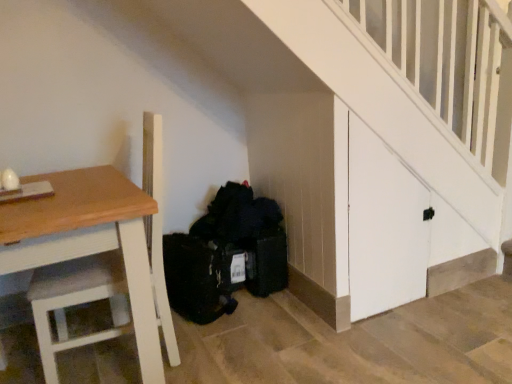
The width and height of the screenshot is (512, 384). Describe the element at coordinates (89, 240) in the screenshot. I see `wooden table at left` at that location.

At what (x,y) coordinates should I click in order to perform the action: click on wooden table at left. Please return your answer as a coordinate pair (x, y). Image resolution: width=512 pixels, height=384 pixels. Looking at the image, I should click on (89, 240).

Image resolution: width=512 pixels, height=384 pixels. What do you see at coordinates (248, 235) in the screenshot?
I see `black fabric bag at lower center` at bounding box center [248, 235].

In order to click on black fabric bag at lower center in this screenshot , I will do `click(248, 235)`.

Where is `wooden table at left`? wooden table at left is located at coordinates (89, 240).

Is wooden table at left at the left side of black fabric bag at lower center?

Indeed, wooden table at left is positioned on the left side of black fabric bag at lower center.

Does wooden table at left lie in front of black fabric bag at lower center?

Yes, wooden table at left is closer to the camera.

Is point (95, 191) positioned behind point (206, 218)?

No, it is in front of (206, 218).

From the image's perspective, is wooden table at left on top of black fabric bag at lower center?

No, from the image's perspective, wooden table at left is not over black fabric bag at lower center.

From a real-world perspective, who is located higher, wooden table at left or black fabric bag at lower center?

In real-world perspective, wooden table at left is above.

From the picture: Which of these two, wooden table at left or black fabric bag at lower center, is thinner?

With smaller width is black fabric bag at lower center.

Who is taller, wooden table at left or black fabric bag at lower center?

Answer: wooden table at left.

Can you confirm if wooden table at left is bigger than black fabric bag at lower center?

Yes.

Is wooden table at left positioned beyond the bounds of black fabric bag at lower center?

That's correct, wooden table at left is outside of black fabric bag at lower center.

Would you say wooden table at left is a long distance from black fabric bag at lower center?

They are positioned close to each other.

Could you tell me if wooden table at left is turned towards black fabric bag at lower center?

Yes, wooden table at left faces towards black fabric bag at lower center.

What's the angular difference between wooden table at left and black fabric bag at lower center's facing directions?

90.4 degrees separate the facing orientations of wooden table at left and black fabric bag at lower center.

You are a GUI agent. You are given a task and a screenshot of the screen. Output one action in this format:
    pyautogui.click(x=<x>, y=<y>)
    Task: Click on the table that is in front of the black fabric bag at lower center
    
    Given the screenshot: What is the action you would take?
    pyautogui.click(x=89, y=240)

Is black fabric bag at lower center to the right of wooden table at left from the viewer's perspective?

Yes, black fabric bag at lower center is to the right of wooden table at left.

Is black fabric bag at lower center closer to the viewer compared to wooden table at left?

No, the depth of black fabric bag at lower center is greater than that of wooden table at left.

Is point (222, 231) closer or farther from the camera than point (81, 248)?

Point (222, 231).

From the image's perspective, is black fabric bag at lower center beneath wooden table at left?

Actually, black fabric bag at lower center appears above wooden table at left in the image.

From a real-world perspective, which is physically above, black fabric bag at lower center or wooden table at left?

wooden table at left.

Can you confirm if black fabric bag at lower center is wider than wooden table at left?

In fact, black fabric bag at lower center might be narrower than wooden table at left.

Considering the relative sizes of black fabric bag at lower center and wooden table at left in the image provided, is black fabric bag at lower center shorter than wooden table at left?

Yes.

Is black fabric bag at lower center bigger than wooden table at left?

No, black fabric bag at lower center is not bigger than wooden table at left.

Is black fabric bag at lower center outside of wooden table at left?

That's correct, black fabric bag at lower center is outside of wooden table at left.

Consider the image. Would you consider black fabric bag at lower center to be distant from wooden table at left?

No.

Consider the image. Is black fabric bag at lower center facing towards wooden table at left?

No, black fabric bag at lower center is not aimed at wooden table at left.

How different are the orientations of black fabric bag at lower center and wooden table at left in degrees?

They differ by 90.4 degrees in their facing directions.

Measure the distance from black fabric bag at lower center to wooden table at left.

black fabric bag at lower center and wooden table at left are 29.84 inches apart from each other.

The width and height of the screenshot is (512, 384). In order to click on table in front of the black fabric bag at lower center in this screenshot , I will do `click(89, 240)`.

The image size is (512, 384). Identify the location of garbage on the right of the wooden table at left. (248, 235).

Identify the location of table above the black fabric bag at lower center (from a real-world perspective). Image resolution: width=512 pixels, height=384 pixels. (89, 240).